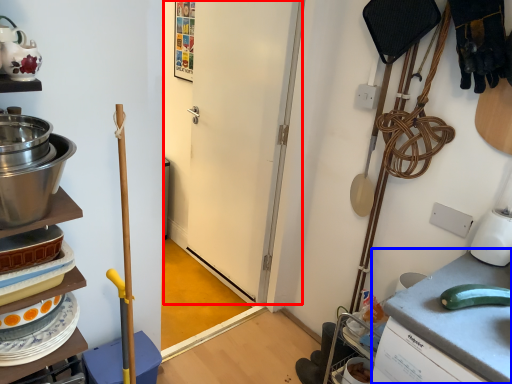
Question: Among these objects, which one is farthest to the camera, door (highlighted by a red box) or counter top (highlighted by a blue box)?

Choices:
 (A) door
 (B) counter top

Answer: (A)